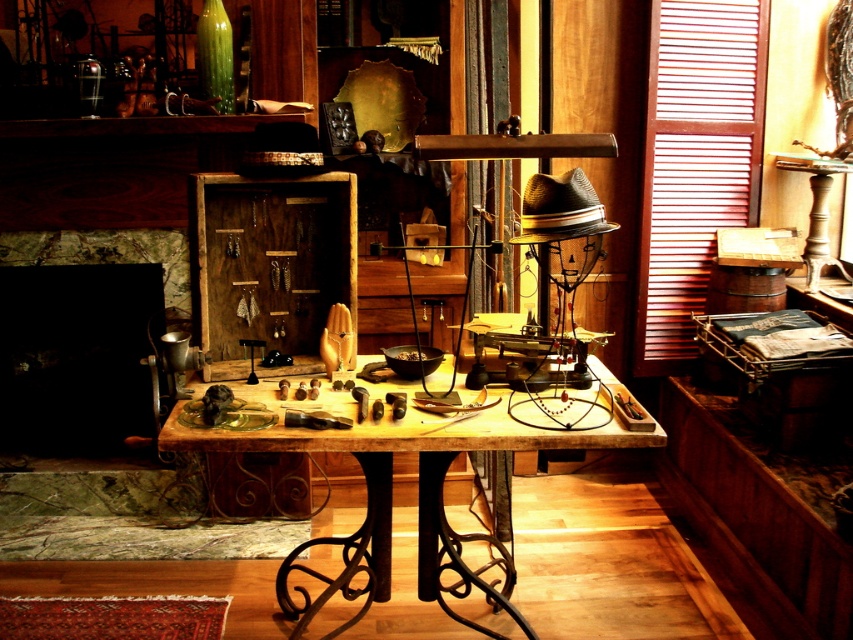
You are standing in the vintage shop and want to hang a small painting on the wall. The painting is 1 meter tall. Can the black matte fireplace at lower left support the painting vertically without blocking the wooden table at center?

The black matte fireplace at lower left is much taller than the wooden table at center, so it can support the painting vertically without blocking the table.

You are a delivery person who needs to place a package on the table. The package is 3 meters long. Can you place the package horizontally between the black matte fireplace at lower left and the table?

The distance between the black matte fireplace at lower left and the table is 3.05 meters, so yes, the package can be placed horizontally between them since it is slightly shorter than the available space.

You are organizing a small event and need to place a 1.2 meter wide decorative panel. Based on the scene, which object between the black matte fireplace at lower left and the wooden table at center can accommodate this panel without overlapping?

The wooden table at center can accommodate the 1.2 meter wide decorative panel since it is larger than the black matte fireplace at lower left.